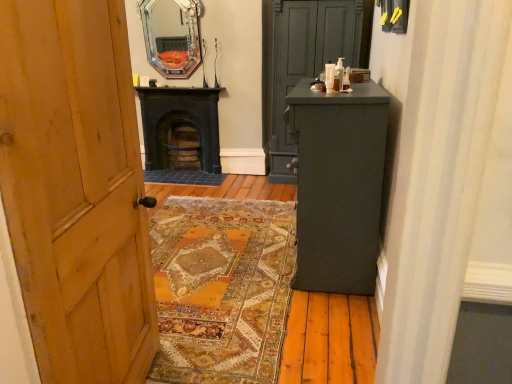
Question: Considering the positions of point (352, 201) and point (215, 173), is point (352, 201) closer or farther from the camera than point (215, 173)?

Choices:
 (A) farther
 (B) closer

Answer: (B)

Question: From the image's perspective, is matte dark gray cabinet at right located above or below black cast iron stove at center?

Choices:
 (A) below
 (B) above

Answer: (A)

Question: Which is farther from the matte gray cabinet at center?

Choices:
 (A) matte dark gray cabinet at right
 (B) black cast iron stove at center
 (C) silver-framed mirror at upper center

Answer: (A)

Question: Estimate the real-world distances between objects in this image. Which object is closer to the black cast iron stove at center?

Choices:
 (A) matte dark gray cabinet at right
 (B) matte gray cabinet at center
 (C) silver-framed mirror at upper center

Answer: (C)